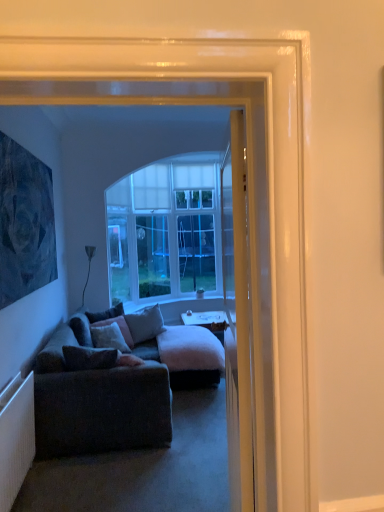
Question: Should I look upward or downward to see velvet gray pillow at center, marked as the fourth pillow in a back-to-front arrangement?

Choices:
 (A) up
 (B) down

Answer: (B)

Question: Considering the relative sizes of gray fabric pillow at center, the second pillow viewed from the back, and dark gray fabric couch at lower left in the image provided, is gray fabric pillow at center, the second pillow viewed from the back, smaller than dark gray fabric couch at lower left?

Choices:
 (A) yes
 (B) no

Answer: (A)

Question: Is dark gray fabric couch at lower left at the back of gray fabric pillow at center, positioned as the third pillow in front-to-back order?

Choices:
 (A) no
 (B) yes

Answer: (A)

Question: Is the position of gray fabric pillow at center, the second pillow viewed from the back, less distant than that of dark gray fabric couch at lower left?

Choices:
 (A) no
 (B) yes

Answer: (A)

Question: Can you confirm if gray fabric pillow at center, positioned as the third pillow in front-to-back order, is positioned to the right of dark gray fabric couch at lower left?

Choices:
 (A) no
 (B) yes

Answer: (B)

Question: From a real-world perspective, is gray fabric pillow at center, the second pillow viewed from the back, beneath dark gray fabric couch at lower left?

Choices:
 (A) yes
 (B) no

Answer: (B)

Question: Does gray fabric pillow at center, positioned as the third pillow in front-to-back order, have a lesser height compared to dark gray fabric couch at lower left?

Choices:
 (A) no
 (B) yes

Answer: (B)

Question: Is white glossy desk at center far away from velvet cushion at center, the third pillow in the back-to-front sequence?

Choices:
 (A) yes
 (B) no

Answer: (A)

Question: Is white glossy desk at center looking in the opposite direction of velvet cushion at center, the 2th pillow viewed from the front?

Choices:
 (A) yes
 (B) no

Answer: (B)

Question: Is white glossy desk at center at the left side of velvet cushion at center, the 2th pillow viewed from the front?

Choices:
 (A) no
 (B) yes

Answer: (A)

Question: Is white glossy desk at center taller than velvet cushion at center, the third pillow in the back-to-front sequence?

Choices:
 (A) yes
 (B) no

Answer: (B)

Question: Can you confirm if white glossy desk at center is bigger than velvet cushion at center, the 2th pillow viewed from the front?

Choices:
 (A) yes
 (B) no

Answer: (A)

Question: Is white glossy desk at center closer to camera compared to velvet cushion at center, the 2th pillow viewed from the front?

Choices:
 (A) no
 (B) yes

Answer: (A)

Question: Considering the relative sizes of white glossy desk at center and dark blue textured painting at upper left in the image provided, is white glossy desk at center shorter than dark blue textured painting at upper left?

Choices:
 (A) no
 (B) yes

Answer: (B)